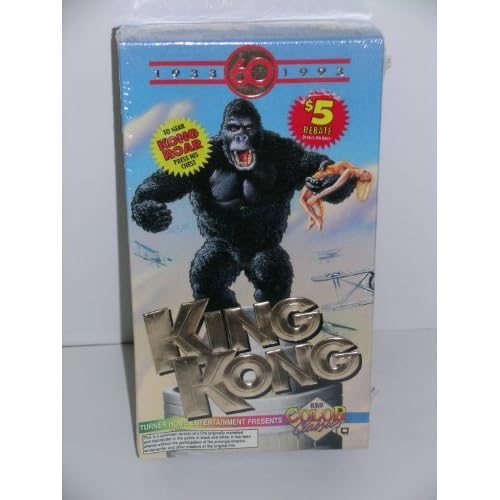
Find the location of `boxed vhs`. boxed vhs is located at coordinates (350, 74).